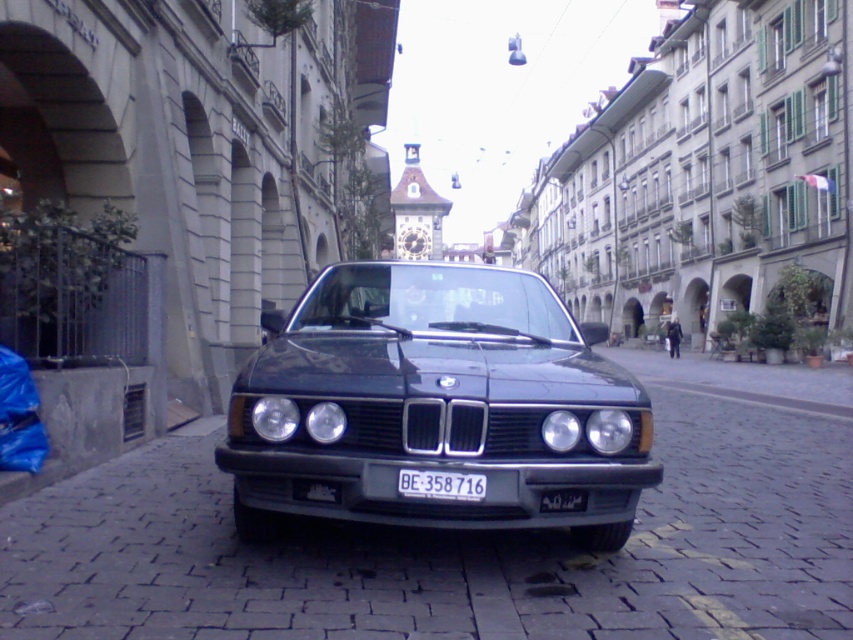
Consider the image. Is matte black car at center shorter than shiny dark green car at center?

Yes.

Is matte black car at center to the left of shiny dark green car at center from the viewer's perspective?

In fact, matte black car at center is to the right of shiny dark green car at center.

Between point (755, 435) and point (593, 541), which one is positioned in front?

Point (593, 541) is more forward.

Identify the location of matte black car at center. The image size is (853, 640). (469, 540).

Between shiny dark green car at center and white plastic license plate at center, which one is positioned higher?

shiny dark green car at center is above.

Does shiny dark green car at center lie behind white plastic license plate at center?

That is True.

Does point (547, 508) lie in front of point (416, 476)?

No.

The image size is (853, 640). I want to click on shiny dark green car at center, so click(x=436, y=406).

The image size is (853, 640). I want to click on matte black car at center, so click(x=469, y=540).

This screenshot has width=853, height=640. Describe the element at coordinates (469, 540) in the screenshot. I see `matte black car at center` at that location.

The height and width of the screenshot is (640, 853). What do you see at coordinates (469, 540) in the screenshot?
I see `matte black car at center` at bounding box center [469, 540].

The image size is (853, 640). What are the coordinates of `matte black car at center` in the screenshot? It's located at (469, 540).